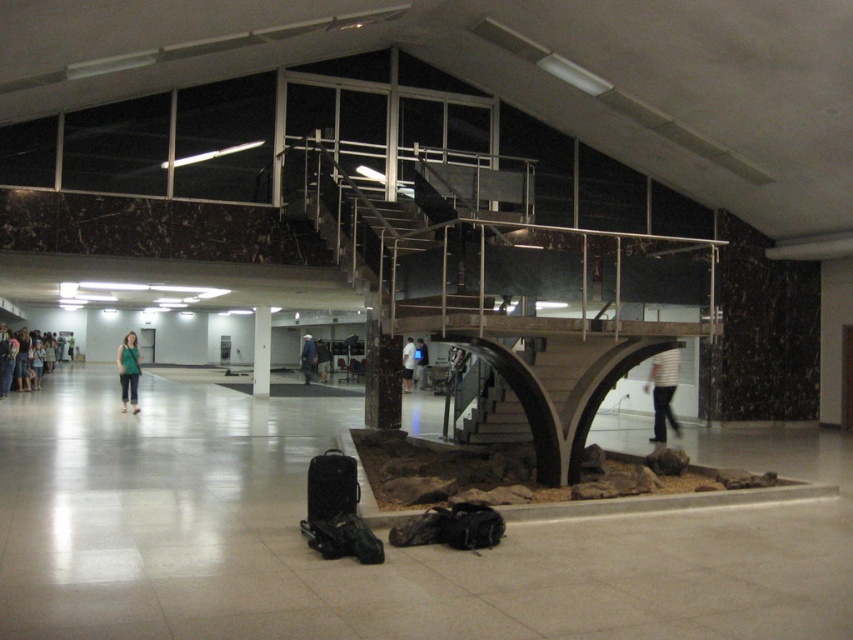
Which is in front, point (660, 397) or point (50, 358)?

Positioned in front is point (660, 397).

The height and width of the screenshot is (640, 853). What do you see at coordinates (663, 392) in the screenshot?
I see `white striped shirt at center` at bounding box center [663, 392].

Find the location of a particular element. This screenshot has height=640, width=853. white striped shirt at center is located at coordinates (663, 392).

Does dark brown wooden stairs at center appear under white marble pillar at center?

Correct, dark brown wooden stairs at center is located below white marble pillar at center.

Can you confirm if dark brown wooden stairs at center is smaller than white marble pillar at center?

Yes.

Between point (532, 340) and point (252, 353), which one is positioned in front?

Point (532, 340) is more forward.

Identify the location of dark brown wooden stairs at center. (527, 388).

Can you confirm if dark brown wooden stairs at center is positioned to the left of white matte shirt at center?

No, dark brown wooden stairs at center is not to the left of white matte shirt at center.

From the picture: Is dark brown wooden stairs at center shorter than white matte shirt at center?

Correct, dark brown wooden stairs at center is not as tall as white matte shirt at center.

You are a GUI agent. You are given a task and a screenshot of the screen. Output one action in this format:
    pyautogui.click(x=<x>, y=<y>)
    Task: Click on the dark brown wooden stairs at center
    
    Given the screenshot: What is the action you would take?
    pyautogui.click(x=527, y=388)